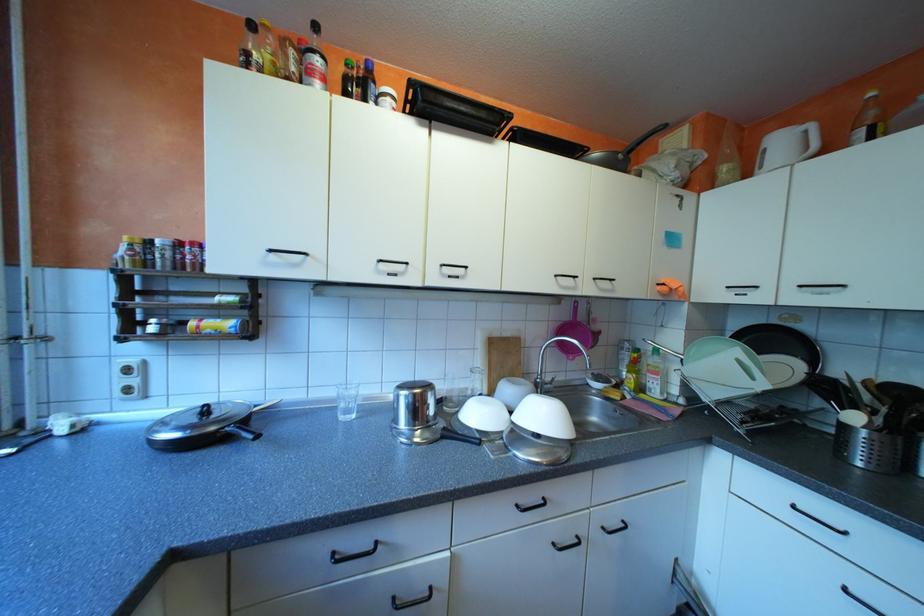
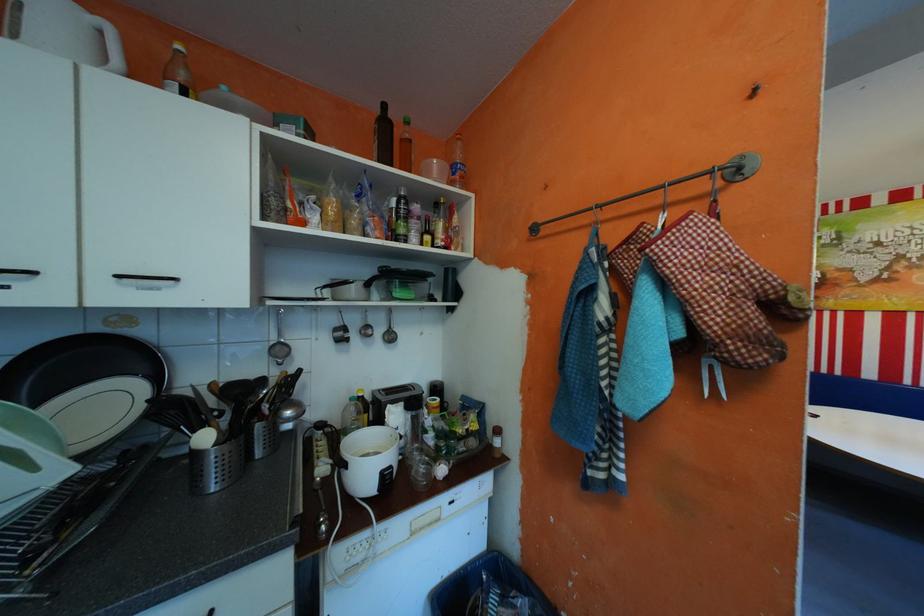
Where in the second image is the point corresponding to the point at 784,334 from the first image?

(105, 353)